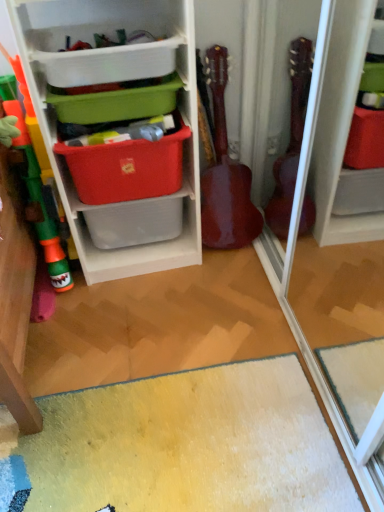
The image size is (384, 512). Describe the element at coordinates (127, 167) in the screenshot. I see `red fabric storage box at center, the first storage box from the bottom` at that location.

Image resolution: width=384 pixels, height=512 pixels. I want to click on green plastic storage box at upper center, the 1th storage box positioned from the top, so click(109, 63).

Find the location of a particular element. plastic storage at left is located at coordinates (117, 80).

Describe the element at coordinates (225, 174) in the screenshot. I see `glossy wood guitar at center` at that location.

Measure the distance between point (87, 114) and camera.

1.30 meters.

Where is `red fabric storage box at center, the first storage box from the bottom`? red fabric storage box at center, the first storage box from the bottom is located at coordinates (127, 167).

Is red fabric storage box at center, the first storage box from the bottom, taller than plastic storage at left?

In fact, red fabric storage box at center, the first storage box from the bottom, may be shorter than plastic storage at left.

From a real-world perspective, is red fabric storage box at center, which is the 3th storage box from top to bottom, beneath plastic storage at left?

Correct, in the physical world, red fabric storage box at center, which is the 3th storage box from top to bottom, is lower than plastic storage at left.

Which is more to the left, red fabric storage box at center, the first storage box from the bottom, or plastic storage at left?

From the viewer's perspective, plastic storage at left appears more on the left side.

Can you tell me how much red fabric storage box at center, the first storage box from the bottom, and plastic storage at left differ in facing direction?

red fabric storage box at center, the first storage box from the bottom, and plastic storage at left are facing 0.00529 degrees away from each other.

From a real-world perspective, is matte plastic storage box at upper center, the 2th storage box from the bottom, on top of red fabric storage box at center, which is the 3th storage box from top to bottom?

Yes, from a real-world perspective, matte plastic storage box at upper center, the 2th storage box from the bottom, is over red fabric storage box at center, which is the 3th storage box from top to bottom

Would you say matte plastic storage box at upper center, the 2th storage box from the bottom, is outside red fabric storage box at center, which is the 3th storage box from top to bottom?

Indeed, matte plastic storage box at upper center, the 2th storage box from the bottom, is completely outside red fabric storage box at center, which is the 3th storage box from top to bottom.

Which is more to the right, matte plastic storage box at upper center, which is the 2th storage box in top-to-bottom order, or red fabric storage box at center, which is the 3th storage box from top to bottom?

red fabric storage box at center, which is the 3th storage box from top to bottom, is more to the right.

Considering the relative sizes of matte plastic storage box at upper center, the 2th storage box from the bottom, and green plastic storage box at upper center, the 1th storage box positioned from the top, in the image provided, is matte plastic storage box at upper center, the 2th storage box from the bottom, bigger than green plastic storage box at upper center, the 1th storage box positioned from the top,?

No, matte plastic storage box at upper center, the 2th storage box from the bottom, is not bigger than green plastic storage box at upper center, the 1th storage box positioned from the top.

From a real-world perspective, is matte plastic storage box at upper center, the 2th storage box from the bottom, physically below green plastic storage box at upper center, which ranks as the third storage box in bottom-to-top order?

Yes, from a real-world perspective, matte plastic storage box at upper center, the 2th storage box from the bottom, is below green plastic storage box at upper center, which ranks as the third storage box in bottom-to-top order.

From the picture: Is matte plastic storage box at upper center, the 2th storage box from the bottom, looking in the opposite direction of green plastic storage box at upper center, the 1th storage box positioned from the top?

matte plastic storage box at upper center, the 2th storage box from the bottom, is not turned away from green plastic storage box at upper center, the 1th storage box positioned from the top.

Based on the photo, considering the relative sizes of matte plastic storage box at upper center, which is the 2th storage box in top-to-bottom order, and green plastic storage box at upper center, the 1th storage box positioned from the top, in the image provided, is matte plastic storage box at upper center, which is the 2th storage box in top-to-bottom order, taller than green plastic storage box at upper center, the 1th storage box positioned from the top,?

Incorrect, the height of matte plastic storage box at upper center, which is the 2th storage box in top-to-bottom order, is not larger of that of green plastic storage box at upper center, the 1th storage box positioned from the top.

Which is closer to the camera, (198, 178) or (116, 103)?

Point (116, 103)

Considering the relative positions of plastic storage at left and matte plastic storage box at upper center, the 2th storage box from the bottom, in the image provided, is plastic storage at left to the right of matte plastic storage box at upper center, the 2th storage box from the bottom, from the viewer's perspective?

Indeed, plastic storage at left is positioned on the right side of matte plastic storage box at upper center, the 2th storage box from the bottom.

Could you measure the distance between plastic storage at left and matte plastic storage box at upper center, which is the 2th storage box in top-to-bottom order?

A distance of 18.46 centimeters exists between plastic storage at left and matte plastic storage box at upper center, which is the 2th storage box in top-to-bottom order.

Can you tell me how much plastic storage at left and matte plastic storage box at upper center, which is the 2th storage box in top-to-bottom order, differ in facing direction?

0.00512 degrees separate the facing orientations of plastic storage at left and matte plastic storage box at upper center, which is the 2th storage box in top-to-bottom order.

Based on the photo, which is farther, (187, 127) or (131, 68)?

Point (187, 127)

Based on the photo, from the image's perspective, does red fabric storage box at center, the first storage box from the bottom, appear higher than green plastic storage box at upper center, which ranks as the third storage box in bottom-to-top order?

No, from the image's perspective, red fabric storage box at center, the first storage box from the bottom, is not above green plastic storage box at upper center, which ranks as the third storage box in bottom-to-top order.

From the image's perspective, starting from the red fabric storage box at center, the first storage box from the bottom, which storage box is the 2nd one above? Please provide its 2D coordinates.

[(109, 63)]

Is the position of green plastic storage box at upper center, which ranks as the third storage box in bottom-to-top order, more distant than that of plastic storage at left?

Yes, it is behind plastic storage at left.

From the image's perspective, is green plastic storage box at upper center, which ranks as the third storage box in bottom-to-top order, located above or below plastic storage at left?

Based on their image positions, green plastic storage box at upper center, which ranks as the third storage box in bottom-to-top order, is located above plastic storage at left.

Considering the sizes of green plastic storage box at upper center, the 1th storage box positioned from the top, and plastic storage at left in the image, is green plastic storage box at upper center, the 1th storage box positioned from the top, taller or shorter than plastic storage at left?

green plastic storage box at upper center, the 1th storage box positioned from the top, is shorter than plastic storage at left.

Is plastic storage at left inside green plastic storage box at upper center, which ranks as the third storage box in bottom-to-top order?

No, plastic storage at left is located outside of green plastic storage box at upper center, which ranks as the third storage box in bottom-to-top order.

How different are the orientations of matte plastic storage box at upper center, the 2th storage box from the bottom, and plastic storage at left in degrees?

0.00512 degrees.

Which storage box is the 1st one when counting from the left side of the plastic storage at left? Please provide its 2D coordinates.

[(116, 104)]

Does matte plastic storage box at upper center, the 2th storage box from the bottom, have a lesser width compared to plastic storage at left?

Correct, the width of matte plastic storage box at upper center, the 2th storage box from the bottom, is less than that of plastic storage at left.

Who is bigger, matte plastic storage box at upper center, which is the 2th storage box in top-to-bottom order, or plastic storage at left?

Bigger between the two is plastic storage at left.

Where is `storage box that is the 3rd one when counting backward from the plastic storage at left`? storage box that is the 3rd one when counting backward from the plastic storage at left is located at coordinates (127, 167).

What are the coordinates of `storage box to the right of matte plastic storage box at upper center, the 2th storage box from the bottom` in the screenshot? It's located at (127, 167).

Looking at the image, which one is located further to red fabric storage box at center, the first storage box from the bottom, glossy wood guitar at center or green plastic storage box at upper center, which ranks as the third storage box in bottom-to-top order?

The object further to red fabric storage box at center, the first storage box from the bottom, is glossy wood guitar at center.

From the image, which object appears to be nearer to green plastic storage box at upper center, the 1th storage box positioned from the top, glossy wood guitar at center or plastic storage at left?

plastic storage at left is closer to green plastic storage box at upper center, the 1th storage box positioned from the top.

Estimate the real-world distances between objects in this image. Which object is further from matte plastic storage box at upper center, which is the 2th storage box in top-to-bottom order, green plastic storage box at upper center, which ranks as the third storage box in bottom-to-top order, or plastic storage at left?

Based on the image, plastic storage at left appears to be further to matte plastic storage box at upper center, which is the 2th storage box in top-to-bottom order.

Based on the photo, which object lies nearer to the anchor point green plastic storage box at upper center, which ranks as the third storage box in bottom-to-top order, matte plastic storage box at upper center, the 2th storage box from the bottom, or plastic storage at left?

matte plastic storage box at upper center, the 2th storage box from the bottom.

When comparing their distances from green plastic storage box at upper center, the 1th storage box positioned from the top, does red fabric storage box at center, the first storage box from the bottom, or plastic storage at left seem further?

red fabric storage box at center, the first storage box from the bottom, lies further to green plastic storage box at upper center, the 1th storage box positioned from the top, than the other object.

From the image, which object appears to be farther from glossy wood guitar at center, matte plastic storage box at upper center, which is the 2th storage box in top-to-bottom order, or red fabric storage box at center, the first storage box from the bottom?

Based on the image, matte plastic storage box at upper center, which is the 2th storage box in top-to-bottom order, appears to be further to glossy wood guitar at center.

Estimate the real-world distances between objects in this image. Which object is closer to green plastic storage box at upper center, the 1th storage box positioned from the top, glossy wood guitar at center or matte plastic storage box at upper center, the 2th storage box from the bottom?

Based on the image, matte plastic storage box at upper center, the 2th storage box from the bottom, appears to be nearer to green plastic storage box at upper center, the 1th storage box positioned from the top.

Which object lies nearer to the anchor point red fabric storage box at center, which is the 3th storage box from top to bottom, plastic storage at left or green plastic storage box at upper center, the 1th storage box positioned from the top?

The object closer to red fabric storage box at center, which is the 3th storage box from top to bottom, is plastic storage at left.

Identify the location of storage box between green plastic storage box at upper center, the 1th storage box positioned from the top, and red fabric storage box at center, the first storage box from the bottom, vertically. Image resolution: width=384 pixels, height=512 pixels. (116, 104).

The height and width of the screenshot is (512, 384). Identify the location of shelf between matte plastic storage box at upper center, the 2th storage box from the bottom, and glossy wood guitar at center. (117, 80).

At what (x,y) coordinates should I click in order to perform the action: click on storage box between green plastic storage box at upper center, which ranks as the third storage box in bottom-to-top order, and plastic storage at left vertically. Please return your answer as a coordinate pair (x, y). This screenshot has width=384, height=512. Looking at the image, I should click on (116, 104).

Identify the location of storage box between plastic storage at left and glossy wood guitar at center in the horizontal direction. The width and height of the screenshot is (384, 512). (127, 167).